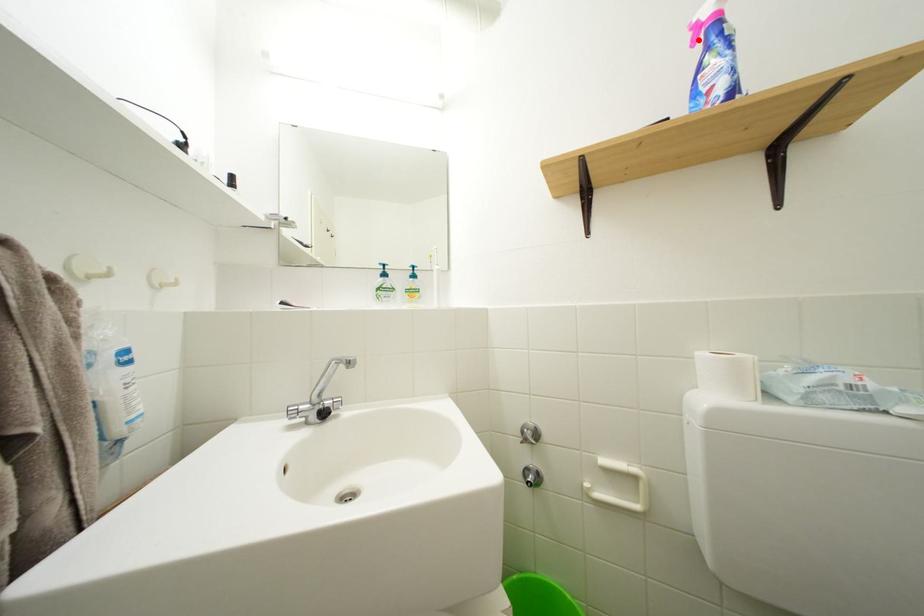
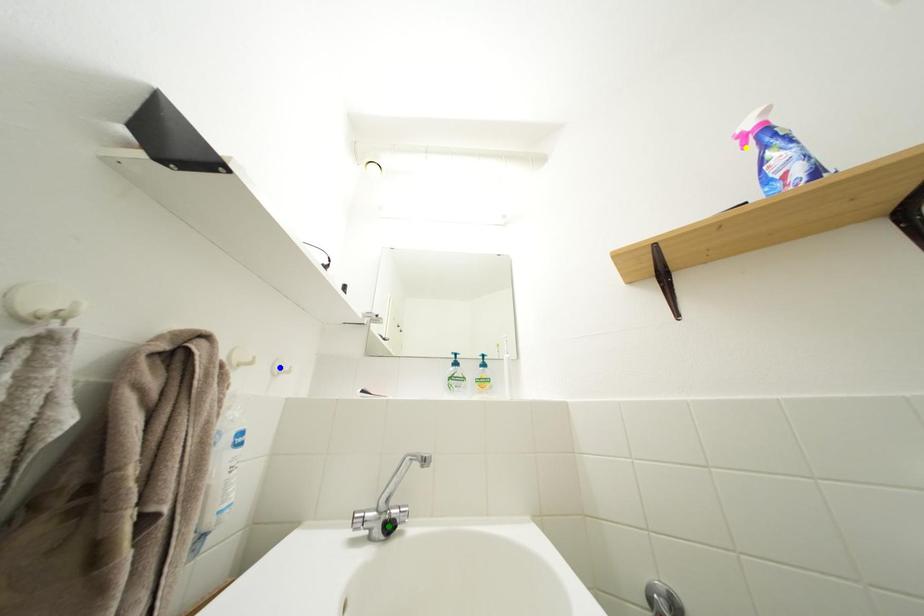
Question: I am providing you with two images of the same scene from different viewpoints. A red point is marked on the first image. You are given multiple points on the second image. Which point in image 2 represents the same 3d spot as the red point in image 1?

Choices:
 (A) green point
 (B) blue point
 (C) yellow point

Answer: (C)